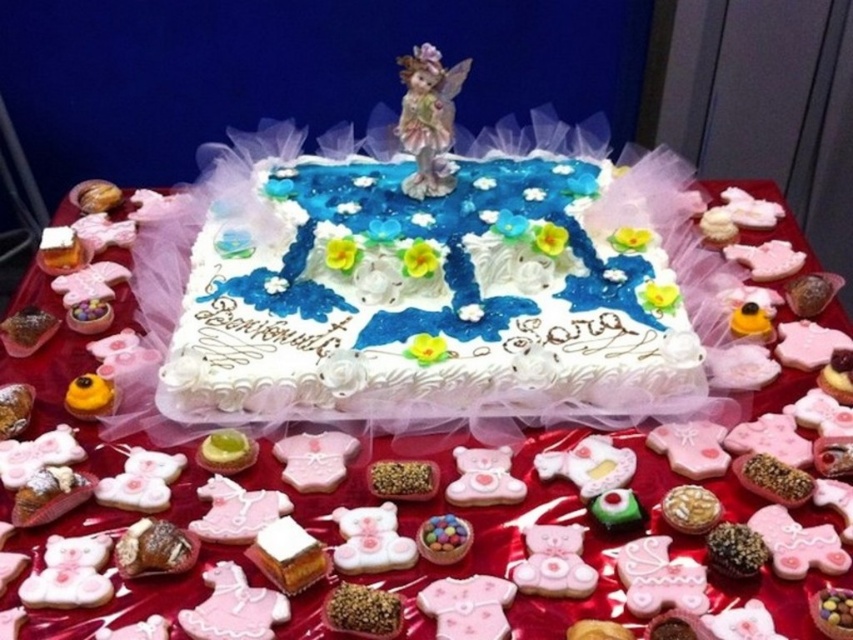
You are standing at the origin point of the table, which is at coordinates 0,0. The cake is placed at coordinates 0.797, 0.502. If you want to move directly towards the white frosted cake at center, in which direction should you move?

You should move northeast towards the white frosted cake at center since its coordinates are 0.797 on the x and 0.502 on the y axis, which is northeast from the origin.

You are a guest at the table and want to take a photo of the white fondant cake at center and the matte plastic eggs at center. Which object should you focus on first to ensure both are in frame?

You should focus on the white fondant cake at center first because it is closer to you than the matte plastic eggs at center, ensuring both are in frame.

You are a guest at a birthday party and see the white frosted cake at center and the matte plastic eggs at center on the table. Which object is located to the left of the other?

The matte plastic eggs at center are located to the left of the white frosted cake at center because the white frosted cake at center is positioned on the right side of matte plastic eggs at center.